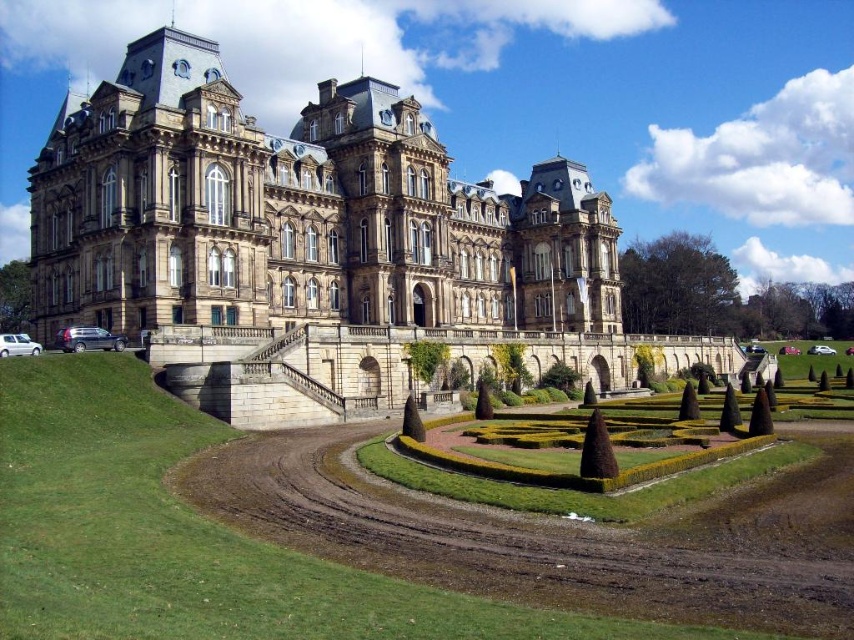
Does point (395, 387) come behind point (124, 387)?

Yes, it is behind point (124, 387).

Is point (162, 355) in front of point (385, 609)?

No, (162, 355) is behind (385, 609).

This screenshot has height=640, width=854. What are the coordinates of `brown stone castle at center` in the screenshot? It's located at (308, 232).